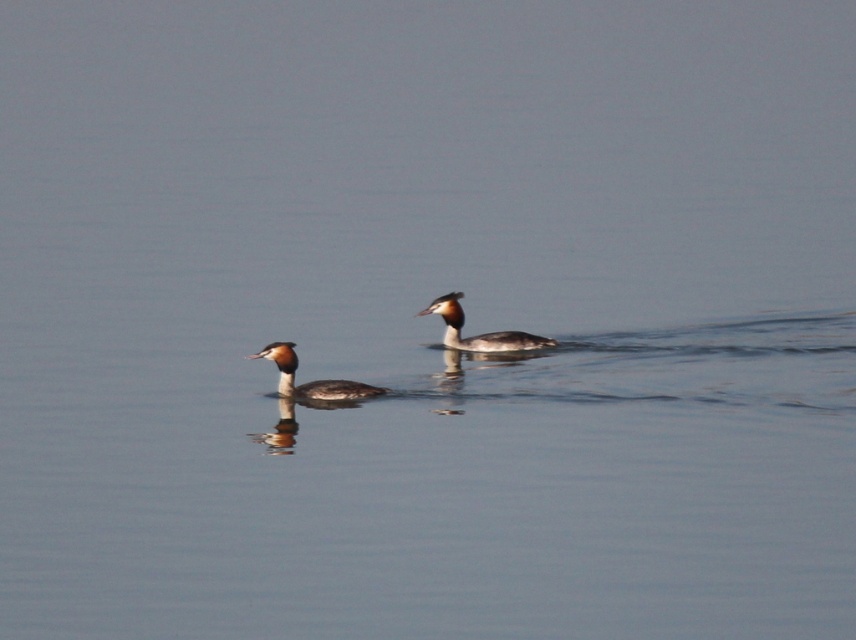
Question: Among these objects, which one is farthest from the camera?

Choices:
 (A) brown speckled duck at center
 (B) brown glossy duck at center

Answer: (B)

Question: Which point is farther to the camera?

Choices:
 (A) brown speckled duck at center
 (B) brown glossy duck at center

Answer: (B)

Question: Does brown speckled duck at center appear over brown glossy duck at center?

Choices:
 (A) yes
 (B) no

Answer: (B)

Question: Does brown speckled duck at center have a lesser width compared to brown glossy duck at center?

Choices:
 (A) no
 (B) yes

Answer: (B)

Question: Which object appears closest to the camera in this image?

Choices:
 (A) brown glossy duck at center
 (B) brown speckled duck at center

Answer: (B)

Question: Can you confirm if brown speckled duck at center is bigger than brown glossy duck at center?

Choices:
 (A) yes
 (B) no

Answer: (B)